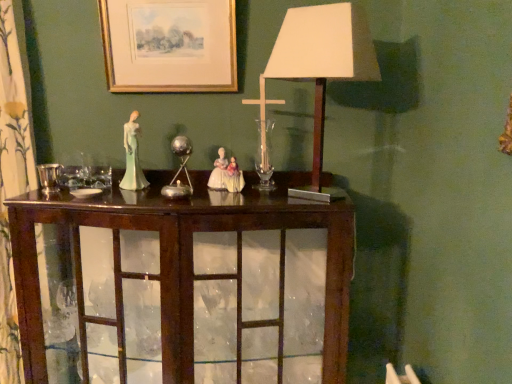
This screenshot has width=512, height=384. I want to click on free location in front of metallic silver candle holder at center, which is the first candle holder in right-to-left order, so click(156, 199).